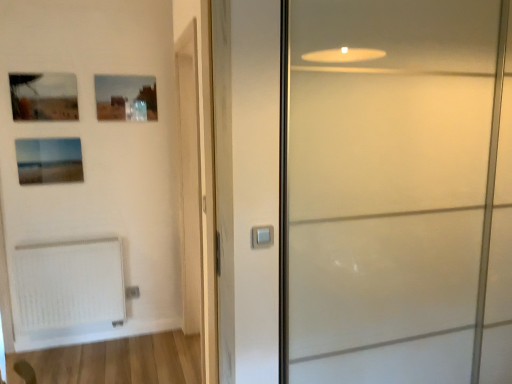
How much space does matte glass picture frame at upper center, acting as the 1th picture frame starting from the top, occupy horizontally?

The width of matte glass picture frame at upper center, acting as the 1th picture frame starting from the top, is 0.91 inches.

Consider the image. How much space does matte glass picture frame at upper left, which appears as the 1th picture frame when ordered from the bottom, occupy horizontally?

The width of matte glass picture frame at upper left, which appears as the 1th picture frame when ordered from the bottom, is 0.91 inches.

Where is `matte glass picture frame at upper center, acting as the 1th picture frame starting from the top`? Image resolution: width=512 pixels, height=384 pixels. matte glass picture frame at upper center, acting as the 1th picture frame starting from the top is located at coordinates (126, 98).

Is frosted glass door at right beside matte glass picture frame at upper left, the second picture frame from the bottom?

frosted glass door at right and matte glass picture frame at upper left, the second picture frame from the bottom, are clearly separated.

Which is more to the right, frosted glass door at right or matte glass picture frame at upper left, the second picture frame from the bottom?

From the viewer's perspective, frosted glass door at right appears more on the right side.

From a real-world perspective, relative to matte glass picture frame at upper left, the second picture frame in the top-to-bottom sequence, is frosted glass door at right vertically above or below?

From a real-world perspective, frosted glass door at right is physically below matte glass picture frame at upper left, the second picture frame in the top-to-bottom sequence.

Looking at this image, considering the sizes of objects frosted glass door at right and matte glass picture frame at upper left, the second picture frame from the bottom, in the image provided, who is smaller, frosted glass door at right or matte glass picture frame at upper left, the second picture frame from the bottom,?

Smaller between the two is matte glass picture frame at upper left, the second picture frame from the bottom.

Considering the positions of points (255, 244) and (238, 226), is point (255, 244) farther from camera compared to point (238, 226)?

Yes, point (255, 244) is behind point (238, 226).

Can you confirm if satin silver switch at center is bigger than frosted glass door at right?

Actually, satin silver switch at center might be smaller than frosted glass door at right.

From a real-world perspective, is satin silver switch at center located beneath frosted glass door at right?

Incorrect, from a real-world perspective, satin silver switch at center is higher than frosted glass door at right.

In the scene shown: Are satin silver switch at center and frosted glass door at right beside each other?

No, satin silver switch at center is not next to frosted glass door at right.

I want to click on the 1st picture frame counting from the left of the matte glass picture frame at upper center, acting as the 1th picture frame starting from the top, so click(42, 96).

Is matte glass picture frame at upper center, which is the third picture frame from bottom to top, at the left side of matte glass picture frame at upper left, the second picture frame from the bottom?

Incorrect, matte glass picture frame at upper center, which is the third picture frame from bottom to top, is not on the left side of matte glass picture frame at upper left, the second picture frame from the bottom.

From a real-world perspective, is matte glass picture frame at upper center, which is the third picture frame from bottom to top, positioned above or below matte glass picture frame at upper left, the second picture frame from the bottom?

matte glass picture frame at upper center, which is the third picture frame from bottom to top, is above matte glass picture frame at upper left, the second picture frame from the bottom.

Can you see wooden barn door at center touching frosted glass door at right?

No, wooden barn door at center is not with frosted glass door at right.

Considering the positions of points (197, 222) and (345, 312), is point (197, 222) farther from camera compared to point (345, 312)?

Yes, point (197, 222) is farther from viewer.

Would you say wooden barn door at center is to the left or to the right of frosted glass door at right in the picture?

From the image, it's evident that wooden barn door at center is to the left of frosted glass door at right.

Is matte glass picture frame at upper left, arranged as the 3th picture frame when viewed from the top, looking in the opposite direction of satin silver switch at center?

No, matte glass picture frame at upper left, arranged as the 3th picture frame when viewed from the top, is not facing away from satin silver switch at center.

From the image's perspective, between matte glass picture frame at upper left, arranged as the 3th picture frame when viewed from the top, and satin silver switch at center, which one is located above?

matte glass picture frame at upper left, arranged as the 3th picture frame when viewed from the top.

Based on the photo, is matte glass picture frame at upper left, arranged as the 3th picture frame when viewed from the top, not within satin silver switch at center?

Indeed, matte glass picture frame at upper left, arranged as the 3th picture frame when viewed from the top, is completely outside satin silver switch at center.

Between matte glass picture frame at upper left, arranged as the 3th picture frame when viewed from the top, and satin silver switch at center, which one has larger width?

matte glass picture frame at upper left, arranged as the 3th picture frame when viewed from the top, is wider.

Is matte glass picture frame at upper left, arranged as the 3th picture frame when viewed from the top, far from matte glass picture frame at upper left, the second picture frame in the top-to-bottom sequence?

That's not correct — matte glass picture frame at upper left, arranged as the 3th picture frame when viewed from the top, is a little close to matte glass picture frame at upper left, the second picture frame in the top-to-bottom sequence.

From the image's perspective, which one is positioned lower, matte glass picture frame at upper left, which appears as the 1th picture frame when ordered from the bottom, or matte glass picture frame at upper left, the second picture frame in the top-to-bottom sequence?

matte glass picture frame at upper left, which appears as the 1th picture frame when ordered from the bottom, is shown below in the image.

From the picture: How distant is matte glass picture frame at upper left, which appears as the 1th picture frame when ordered from the bottom, from matte glass picture frame at upper left, the second picture frame in the top-to-bottom sequence?

matte glass picture frame at upper left, which appears as the 1th picture frame when ordered from the bottom, is 11.58 inches away from matte glass picture frame at upper left, the second picture frame in the top-to-bottom sequence.

Is point (25, 182) farther from viewer compared to point (31, 96)?

Yes.

Are wooden barn door at center and matte glass picture frame at upper left, which appears as the 1th picture frame when ordered from the bottom, making contact?

No, wooden barn door at center is not with matte glass picture frame at upper left, which appears as the 1th picture frame when ordered from the bottom.

From the picture: How many degrees apart are the facing directions of wooden barn door at center and matte glass picture frame at upper left, arranged as the 3th picture frame when viewed from the top?

The angle between the facing direction of wooden barn door at center and the facing direction of matte glass picture frame at upper left, arranged as the 3th picture frame when viewed from the top, is 90.8 degrees.

How much distance is there between wooden barn door at center and matte glass picture frame at upper left, arranged as the 3th picture frame when viewed from the top?

The distance of wooden barn door at center from matte glass picture frame at upper left, arranged as the 3th picture frame when viewed from the top, is 36.44 inches.

Considering the relative positions of wooden barn door at center and matte glass picture frame at upper left, which appears as the 1th picture frame when ordered from the bottom, in the image provided, is wooden barn door at center to the right of matte glass picture frame at upper left, which appears as the 1th picture frame when ordered from the bottom, from the viewer's perspective?

Yes, wooden barn door at center is to the right of matte glass picture frame at upper left, which appears as the 1th picture frame when ordered from the bottom.

From the frosted glass door at right, count the 2nd picture frame to the left and point to it. Please provide its 2D coordinates.

[(42, 96)]

At what (x,y) coordinates should I click in order to perform the action: click on door in front of the satin silver switch at center. Please return your answer as a coordinate pair (x, y). The height and width of the screenshot is (384, 512). Looking at the image, I should click on (368, 189).

From the image, which object appears to be nearer to wooden barn door at center, satin silver switch at center or matte glass picture frame at upper center, which is the third picture frame from bottom to top?

matte glass picture frame at upper center, which is the third picture frame from bottom to top, lies closer to wooden barn door at center than the other object.

From the image, which object appears to be farther from wooden barn door at center, matte glass picture frame at upper center, acting as the 1th picture frame starting from the top, or white textured radiator at lower left?

Among the two, white textured radiator at lower left is located further to wooden barn door at center.

Which object lies further to the anchor point wooden barn door at center, matte glass picture frame at upper left, the second picture frame from the bottom, or matte glass picture frame at upper left, arranged as the 3th picture frame when viewed from the top?

matte glass picture frame at upper left, the second picture frame from the bottom, is positioned further to the anchor wooden barn door at center.

From the image, which object appears to be farther from frosted glass door at right, white textured radiator at lower left or satin silver switch at center?

white textured radiator at lower left lies further to frosted glass door at right than the other object.

From the image, which object appears to be farther from matte glass picture frame at upper center, acting as the 1th picture frame starting from the top, white textured radiator at lower left or frosted glass door at right?

frosted glass door at right is further to matte glass picture frame at upper center, acting as the 1th picture frame starting from the top.

Estimate the real-world distances between objects in this image. Which object is closer to frosted glass door at right, matte glass picture frame at upper left, arranged as the 3th picture frame when viewed from the top, or matte glass picture frame at upper left, the second picture frame in the top-to-bottom sequence?

matte glass picture frame at upper left, arranged as the 3th picture frame when viewed from the top, lies closer to frosted glass door at right than the other object.

Which object lies nearer to the anchor point white textured radiator at lower left, satin silver switch at center or frosted glass door at right?

Based on the image, frosted glass door at right appears to be nearer to white textured radiator at lower left.

From the image, which object appears to be nearer to satin silver switch at center, matte glass picture frame at upper center, which is the third picture frame from bottom to top, or frosted glass door at right?

frosted glass door at right.

Locate an element on the screen. This screenshot has height=384, width=512. barn door located between white textured radiator at lower left and frosted glass door at right in the left-right direction is located at coordinates (189, 178).

The height and width of the screenshot is (384, 512). I want to click on picture frame between matte glass picture frame at upper left, arranged as the 3th picture frame when viewed from the top, and matte glass picture frame at upper center, acting as the 1th picture frame starting from the top, in the horizontal direction, so click(x=42, y=96).

Locate an element on the screen. radiator between matte glass picture frame at upper left, which appears as the 1th picture frame when ordered from the bottom, and satin silver switch at center is located at coordinates (70, 287).

At what (x,y) coordinates should I click in order to perform the action: click on picture frame situated between matte glass picture frame at upper left, the second picture frame from the bottom, and wooden barn door at center from left to right. Please return your answer as a coordinate pair (x, y). Looking at the image, I should click on (126, 98).